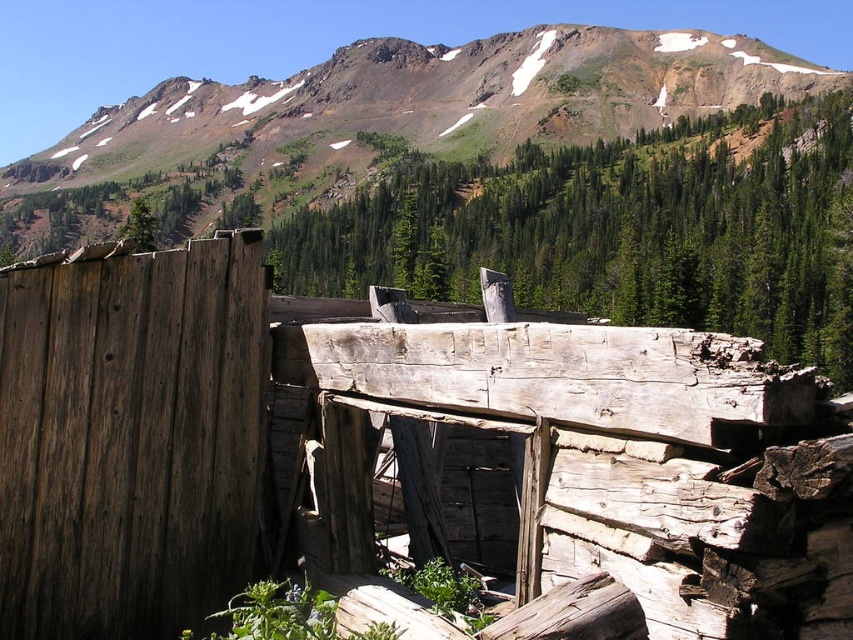
Question: Among these objects, which one is nearest to the camera?

Choices:
 (A) rugged brown mountain at upper center
 (B) dark brown weathered wood at left
 (C) weathered wood fence at left

Answer: (C)

Question: Does weathered wood fence at left have a larger size compared to rugged brown mountain at upper center?

Choices:
 (A) no
 (B) yes

Answer: (A)

Question: Does weathered wood fence at left have a greater width compared to dark brown weathered wood at left?

Choices:
 (A) no
 (B) yes

Answer: (B)

Question: Can you confirm if weathered wood fence at left is wider than dark brown weathered wood at left?

Choices:
 (A) yes
 (B) no

Answer: (A)

Question: Among these points, which one is nearest to the camera?

Choices:
 (A) (308, 115)
 (B) (281, 397)

Answer: (B)

Question: Which object is the closest to the weathered wood fence at left?

Choices:
 (A) dark brown weathered wood at left
 (B) rugged brown mountain at upper center

Answer: (A)